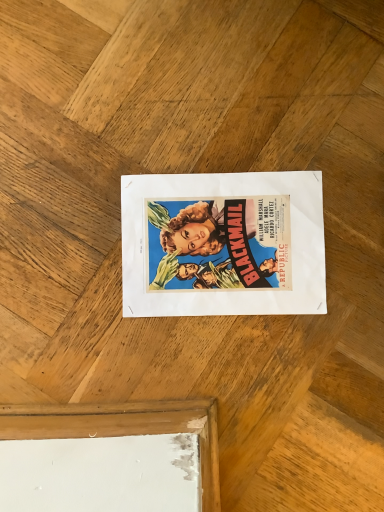
Identify the location of empty space that is ontop of matte paper poster at center (from a real-world perspective). (221, 238).